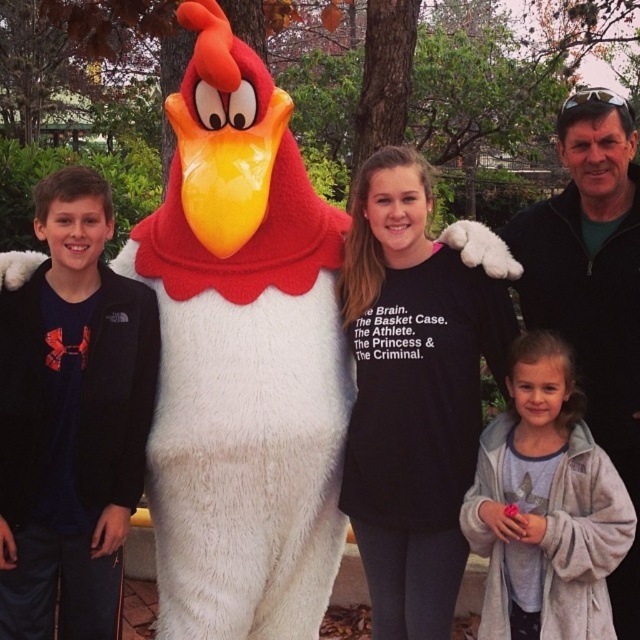
Who is taller, black cotton shirt at center or light gray fleece robe at lower right?

Standing taller between the two is black cotton shirt at center.

Is black cotton shirt at center thinner than light gray fleece robe at lower right?

No.

Locate an element on the screen. black cotton shirt at center is located at coordinates (417, 387).